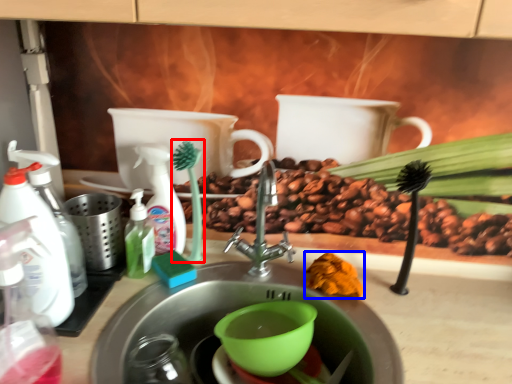
Question: Which of the following is the closest to the observer, plant (highlighted by a red box) or food (highlighted by a blue box)?

Choices:
 (A) plant
 (B) food

Answer: (B)